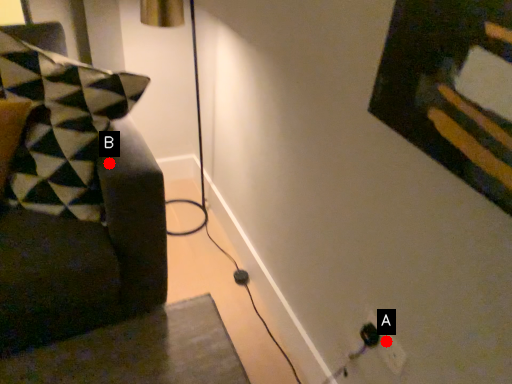
Question: Two points are circled on the image, labeled by A and B beside each circle. Among these points, which one is farthest from the camera?

Choices:
 (A) A is further
 (B) B is further

Answer: (B)